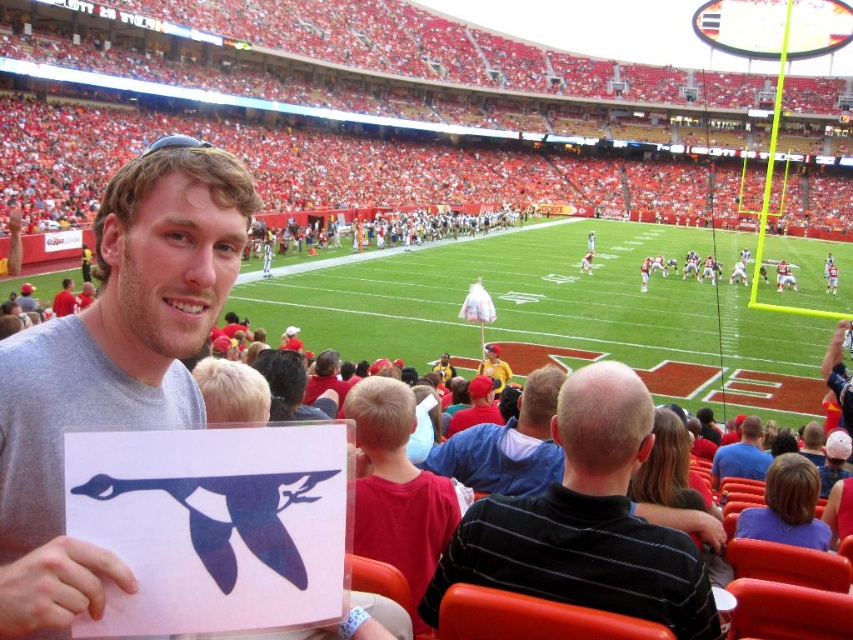
Question: In this image, where is gray matte t-shirt at center located relative to yellow fabric at center?

Choices:
 (A) left
 (B) right

Answer: (A)

Question: Among these objects, which one is nearest to the camera?

Choices:
 (A) gray matte t-shirt at center
 (B) red shirt at center
 (C) black striped shirt at center
 (D) smooth blue shirt at center

Answer: (A)

Question: Estimate the real-world distances between objects in this image. Which object is farther from the yellow fabric at center?

Choices:
 (A) red fabric cap at center
 (B) red shirt at center

Answer: (B)

Question: Is black striped shirt at center smaller than red fabric cap at center?

Choices:
 (A) no
 (B) yes

Answer: (A)

Question: Among these objects, which one is farthest from the camera?

Choices:
 (A) smooth blue shirt at center
 (B) blue fabric shirt at center
 (C) yellow fabric at center

Answer: (C)

Question: Does gray matte t-shirt at center have a lesser width compared to blue fabric shirt at center?

Choices:
 (A) no
 (B) yes

Answer: (A)